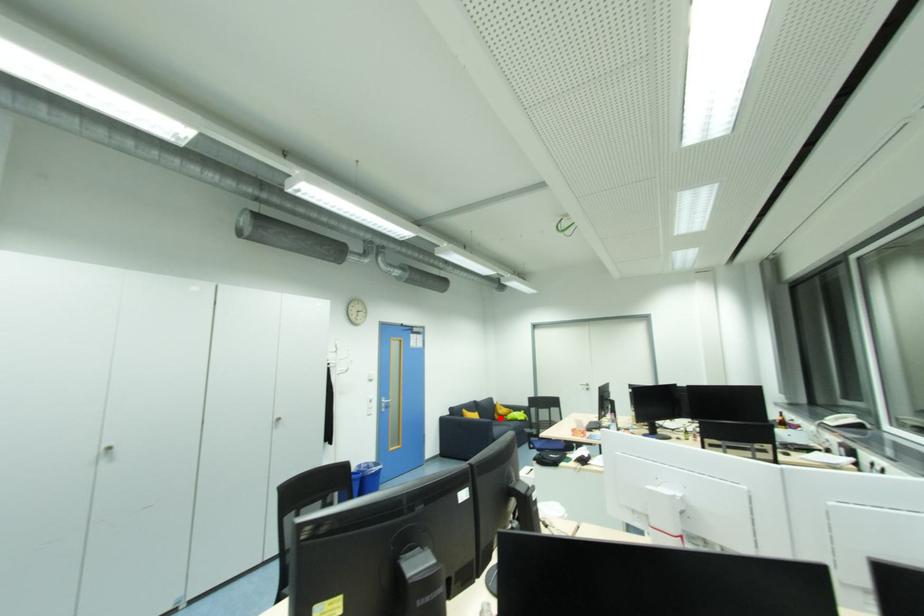
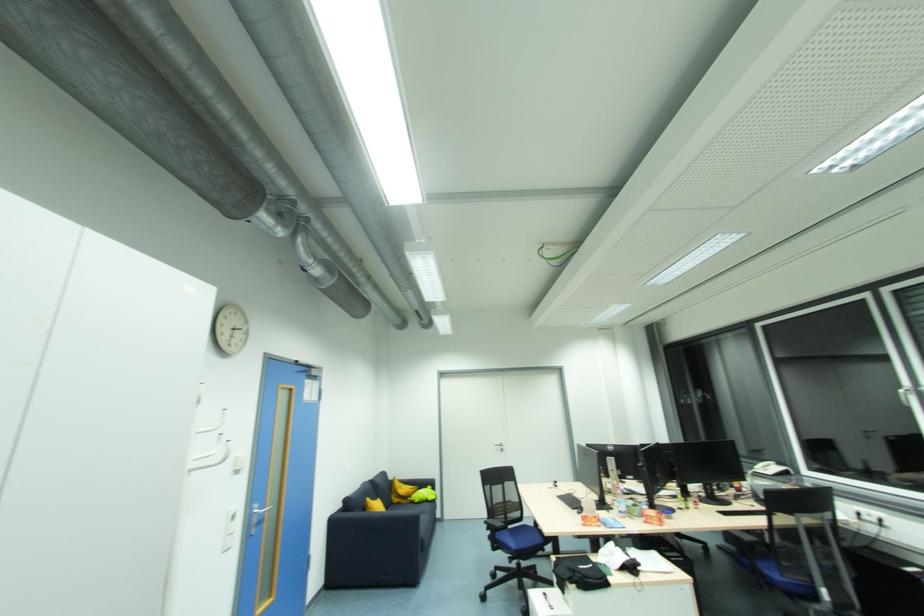
The point at the highlighted location is marked in the first image. Where is the corresponding point in the second image?

(397, 501)